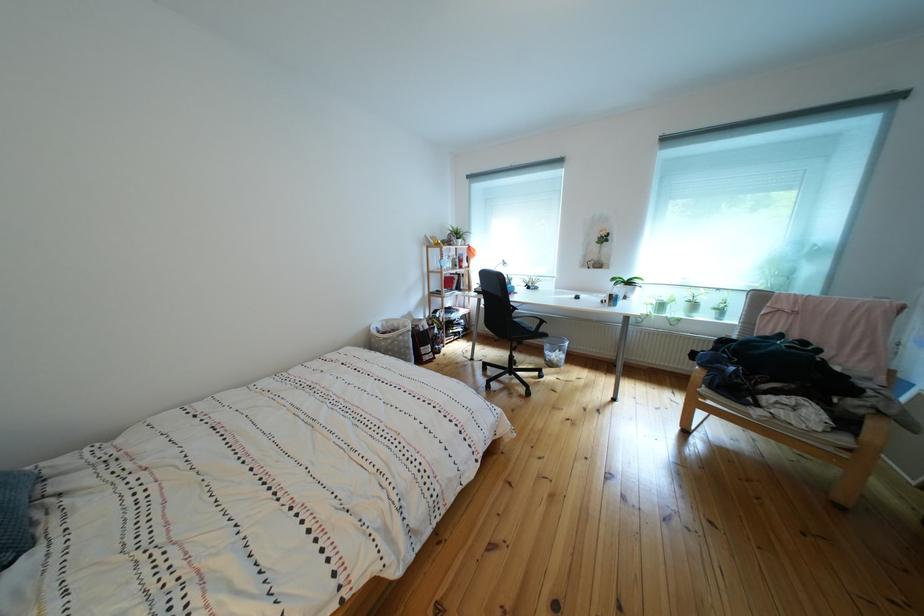
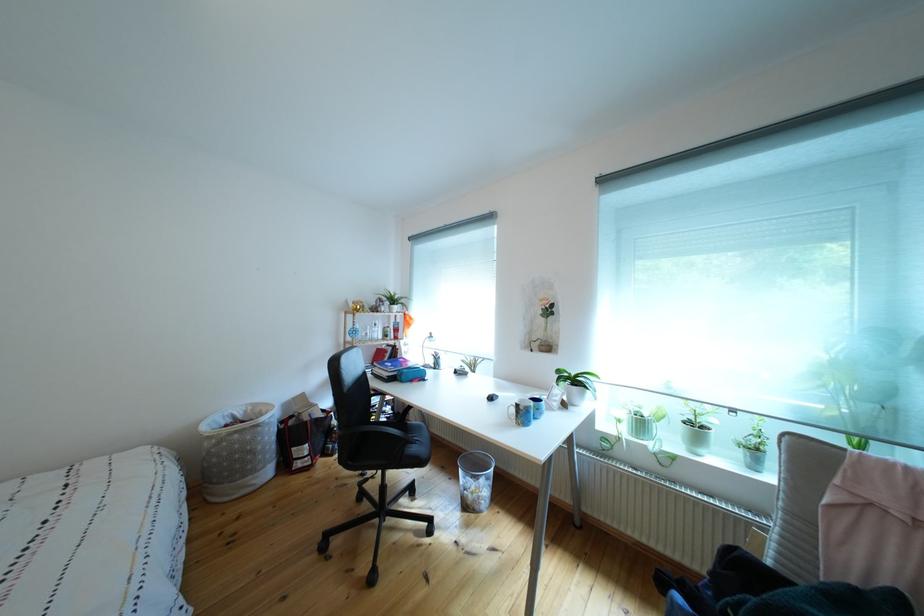
The point at (x=640, y=289) is marked in the first image. Where is the corresponding point in the second image?

(588, 387)